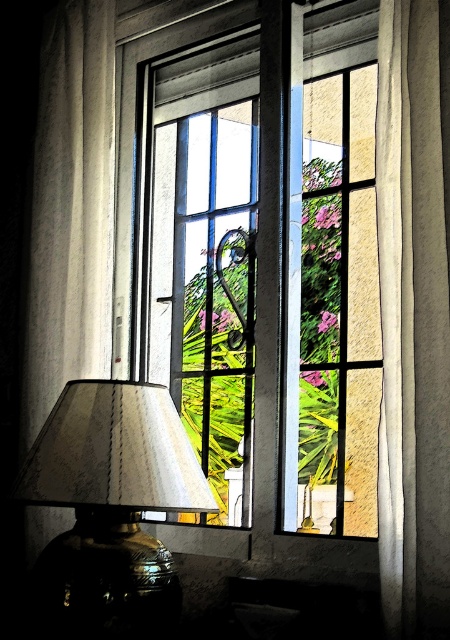
You are standing in the room and want to touch the clear glass window at center. Can you reach the point at coordinates point (x=280, y=275) on the window?

The point (x=280, y=275) is on the clear glass window at center, so yes, you can reach it by extending your hand towards the window.

Based on the photo, you are arranging a photo shoot and need to position a model between the matte silver lampshade at lower left and the white textured curtain at right. Based on their heights, which object should the model stand closer to for the best composition?

The matte silver lampshade at lower left is shorter than the white textured curtain at right, so the model should stand closer to the matte silver lampshade at lower left to balance the composition with the shorter object.

You are arranging a photo shoot in this room and need to position a model between the matte silver lampshade at lower left and the white textured curtain at right. Based on their positions, which object should the model stand closer to if they want to be equidistant from both?

The model should stand closer to the matte silver lampshade at lower left because it is positioned below the white textured curtain at right, meaning the vertical distance between them requires the model to be nearer to the lower object to maintain equal distance.